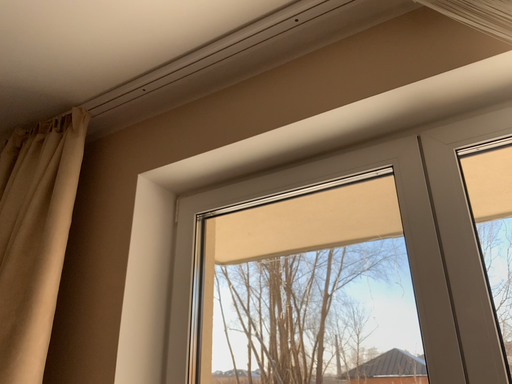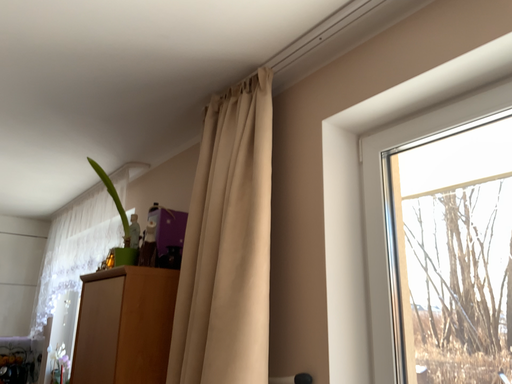
Question: How did the camera likely rotate when shooting the video?

Choices:
 (A) rotated upward
 (B) rotated downward

Answer: (B)